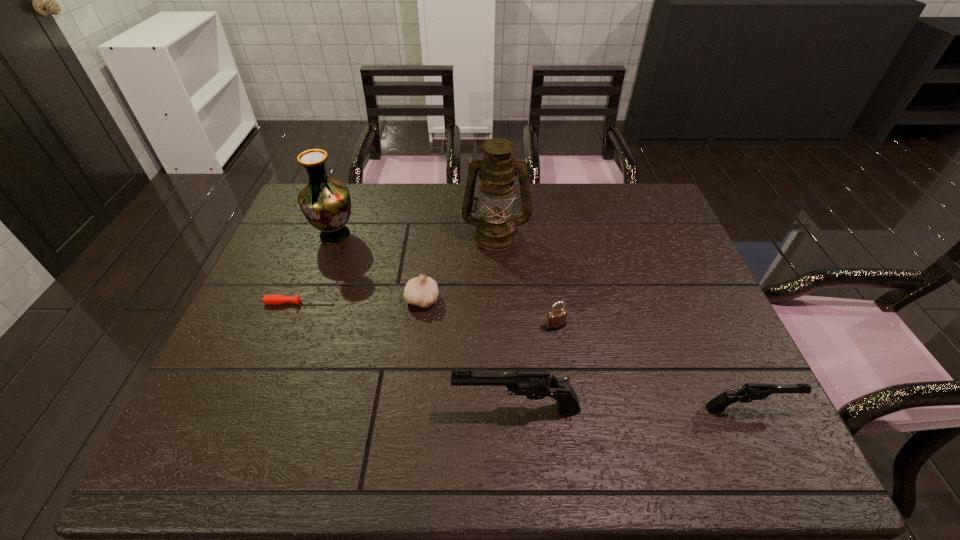
Identify which object is the sixth nearest to the third object from left to right. Please provide its 2D coordinates. Your answer should be formatted as a tuple, i.e. [(x, y)], where the tuple contains the x and y coordinates of a point satisfying the conditions above.

[(749, 392)]

Locate an element on the screen. object that stands as the closest to the sixth shortest object is located at coordinates (267, 299).

You are a GUI agent. You are given a task and a screenshot of the screen. Output one action in this format:
    pyautogui.click(x=<x>, y=<y>)
    Task: Click on the vacant region that satisfies the following two spatial constraints: 1. at the tip of the screwdriver; 2. on the back side of the third nearest object
    Image resolution: width=960 pixels, height=540 pixels.
    Given the screenshot: What is the action you would take?
    pyautogui.click(x=291, y=326)